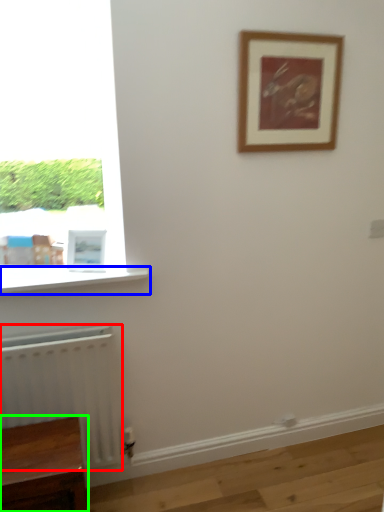
Question: Which object is the farthest from radiator (highlighted by a red box)? Choose among these: window sill (highlighted by a blue box) or furniture (highlighted by a green box).

Choices:
 (A) window sill
 (B) furniture

Answer: (A)